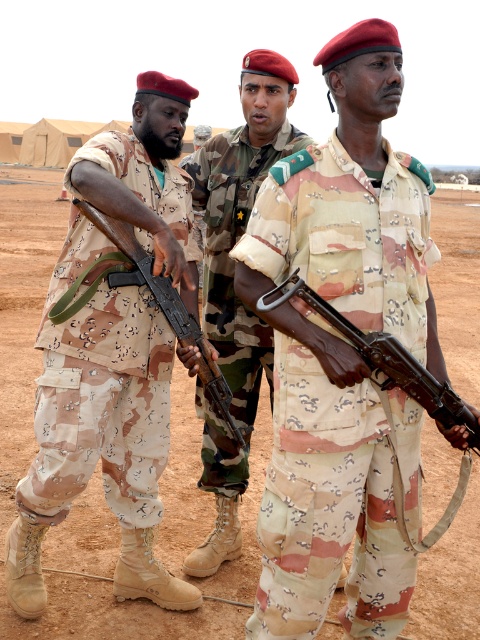
You are a soldier in the desert and need to choose a rifle to carry. The camouflage fabric rifle at center and the wooden rifle at center are available. Which one is larger and would be more comfortable for carrying?

The camouflage fabric rifle at center is bigger than wooden rifle at center, so it would be more comfortable for carrying as it likely has a better ergonomic design.

Based on the scene description, which object is positioned higher in the image, the dirt field at center or the camouflage fabric uniform at center?

The dirt field at center is positioned above the camouflage fabric uniform at center according to the description.

In the scene shown: You are a soldier in the desert and need to quickly grab a rifle from the two in the center. Which rifle can you reach first, the camouflage fabric rifle at center or the wooden rifle at center?

The camouflage fabric rifle at center is closer to the viewer than the wooden rifle at center, so you can reach it first.